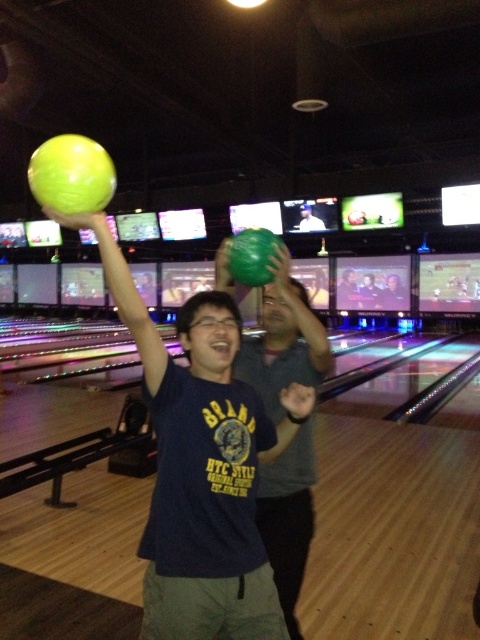
You are standing in the bowling alley and see the point marked at coordinates (x=284, y=257). If you want to place a 1.5 meter long banner horizontally from that point towards the direction of the bowling lanes, will the banner fit without extending beyond the lanes?

The point at coordinates (x=284, y=257) is 1.70 meters away from the viewer. Since the banner is 1.5 meters long, it will fit within the distance as 1.5 meters is less than 1.70 meters. Therefore, the banner can be placed without extending beyond the lanes.

You are a bowler standing at the approach area of the lane and want to roll the green rubber bowling ball at upper center and the matte green bowling ball at center into the pins. Considering the lane length is 60 feet, will both balls reach the pins if you release them at the same time?

The distance between the green rubber bowling ball at upper center and the matte green bowling ball at center is 24.67 feet. Since the lane length is 60 feet, both balls will need to travel more than twice their separation distance to reach the pins. However, bowling balls are typically released from the bowler at the foul line, which is at the start of the lane. Therefore, as long as you release both balls with enough force to cover the 60 feet, they will reach the pins. The separation between them doesn

You are standing at the starting position on the bowling lane and see two points marked on the lane. The first point is at coordinate point (196,352) and the second is at point (303,225). Which point is closer to you?

Point (196,352) is in front of point (303,225), so it is closer to you.